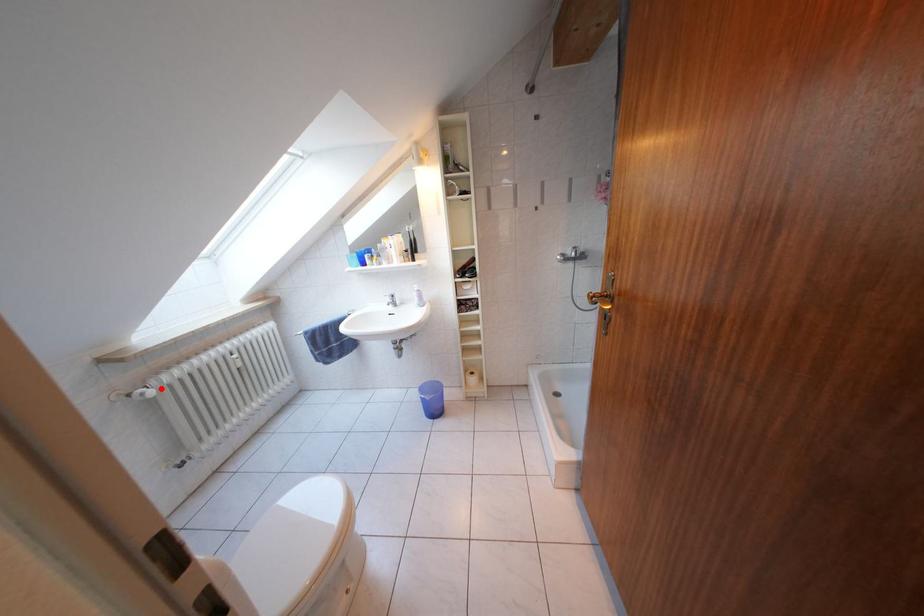
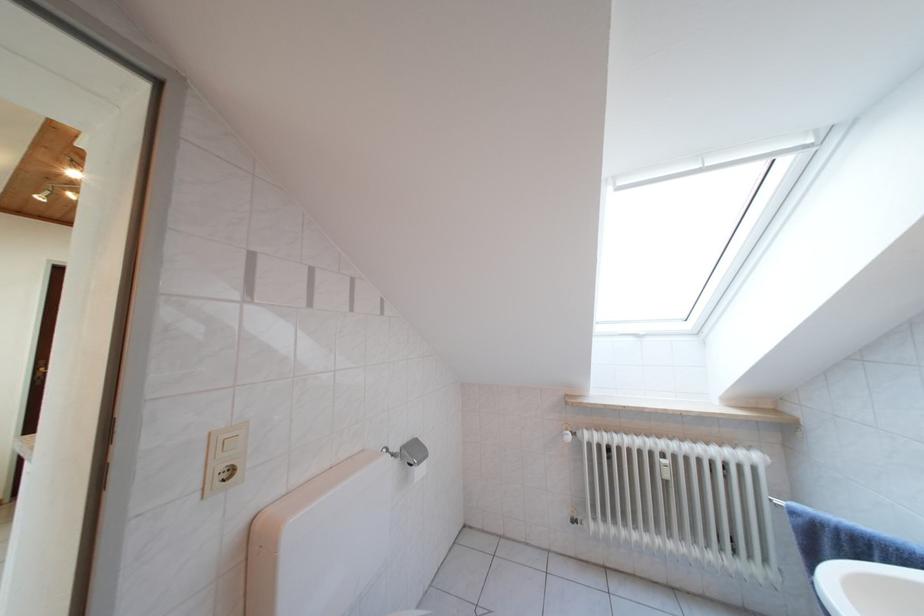
Locate, in the second image, the point that corresponds to the highlighted location in the first image.

(588, 439)